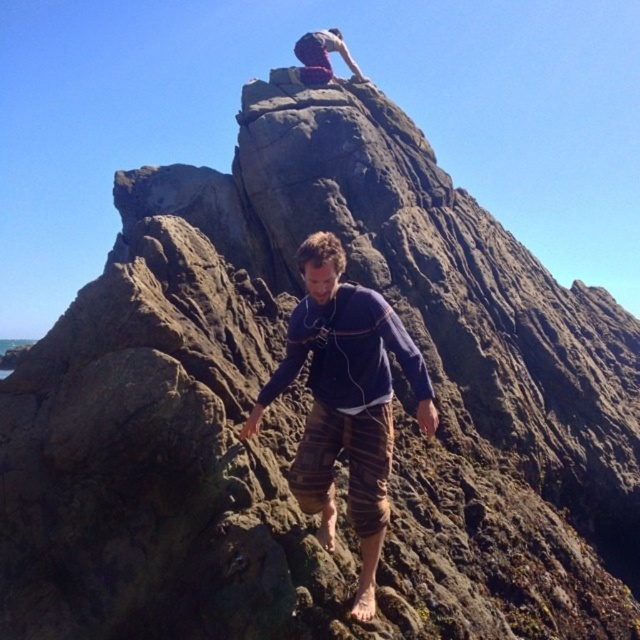
Locate an element on the screen. The width and height of the screenshot is (640, 640). striped cotton shorts at center is located at coordinates (346, 401).

Does striped cotton shorts at center have a lesser width compared to red fabric pants at upper center?

Incorrect, striped cotton shorts at center's width is not less than red fabric pants at upper center's.

Describe the element at coordinates (346, 401) in the screenshot. The width and height of the screenshot is (640, 640). I see `striped cotton shorts at center` at that location.

This screenshot has height=640, width=640. Identify the location of striped cotton shorts at center. (346, 401).